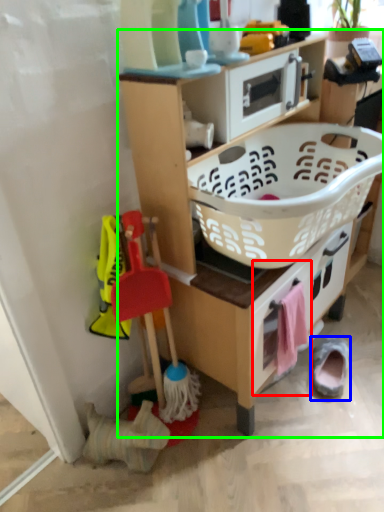
Question: Estimate the real-world distances between objects in this image. Which object is farther from drawer (highlighted by a red box), footwear (highlighted by a blue box) or shelf (highlighted by a green box)?

Choices:
 (A) footwear
 (B) shelf

Answer: (A)